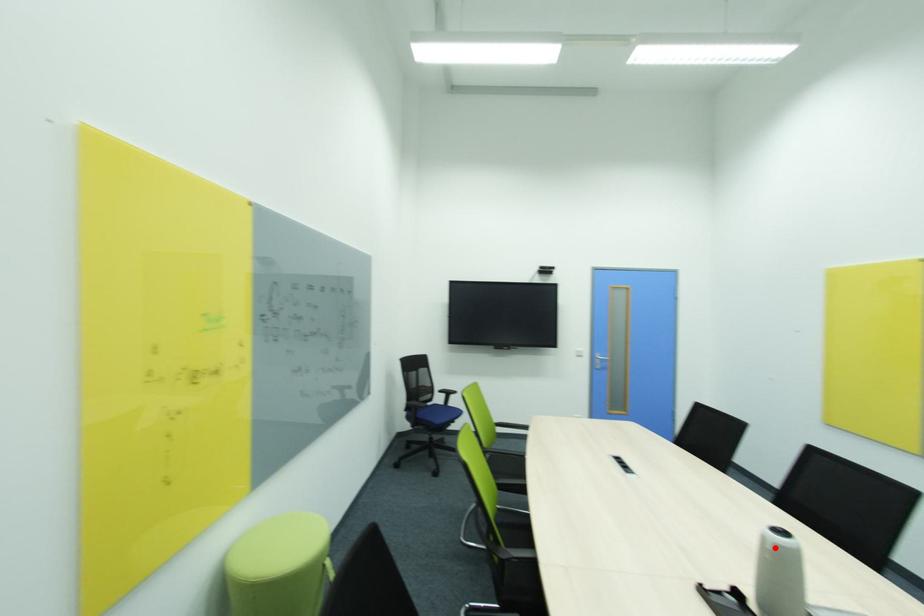
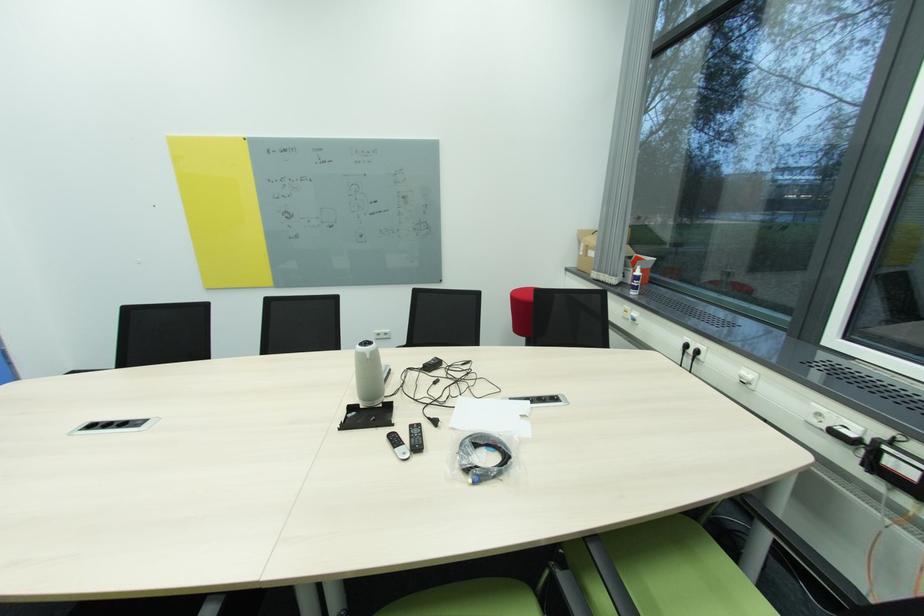
Question: I am providing you with two images of the same scene from different viewpoints. In image1, a red point is highlighted. Considering the same 3D point in image2, which of the following is correct?

Choices:
 (A) It is closer
 (B) It is farther

Answer: (A)